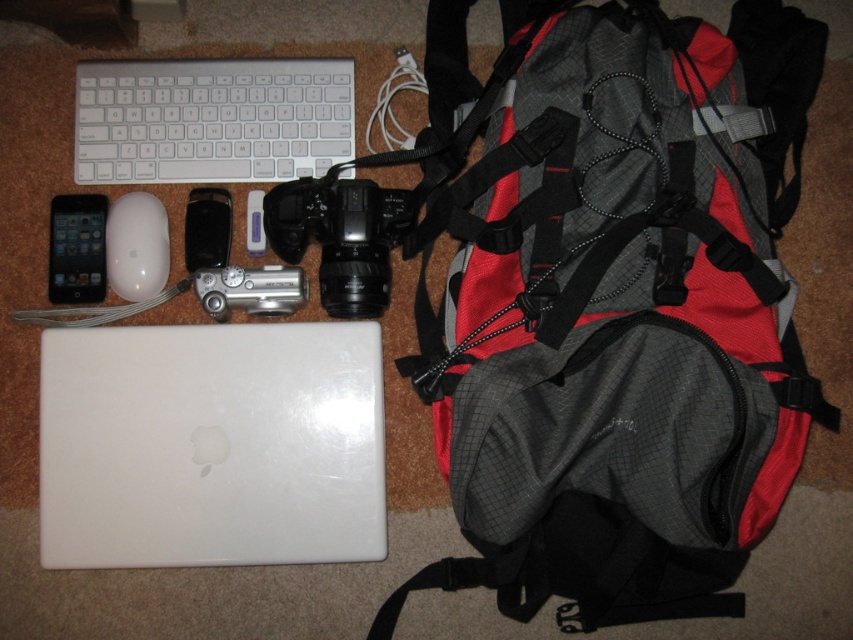
Is the position of silver metallic digital camera at center more distant than that of black matte ipod at upper left?

No, it is in front of black matte ipod at upper left.

Who is taller, silver metallic digital camera at center or black matte ipod at upper left?

With more height is black matte ipod at upper left.

Is point (247, 282) positioned in front of point (216, 236)?

Yes, it is in front of point (216, 236).

Locate an element on the screen. The height and width of the screenshot is (640, 853). silver metallic digital camera at center is located at coordinates (250, 291).

Looking at this image, is red mesh backpack at right bigger than silver metallic digital camera at center?

Indeed, red mesh backpack at right has a larger size compared to silver metallic digital camera at center.

Is red mesh backpack at right wider than silver metallic digital camera at center?

Correct, the width of red mesh backpack at right exceeds that of silver metallic digital camera at center.

Describe the element at coordinates (614, 307) in the screenshot. Image resolution: width=853 pixels, height=640 pixels. I see `red mesh backpack at right` at that location.

Where is `red mesh backpack at right`? red mesh backpack at right is located at coordinates (614, 307).

Describe the element at coordinates (614, 307) in the screenshot. The width and height of the screenshot is (853, 640). I see `red mesh backpack at right` at that location.

Is red mesh backpack at right positioned at the back of white matte laptop at center?

No, it is not.

Who is more forward, (709, 92) or (67, 544)?

Point (709, 92) is in front.

In order to click on red mesh backpack at right in this screenshot , I will do [614, 307].